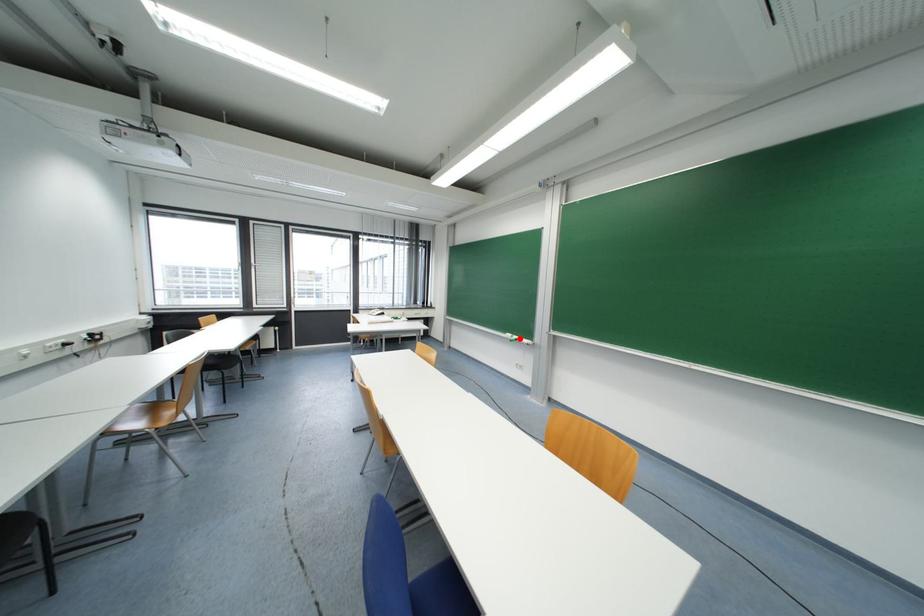
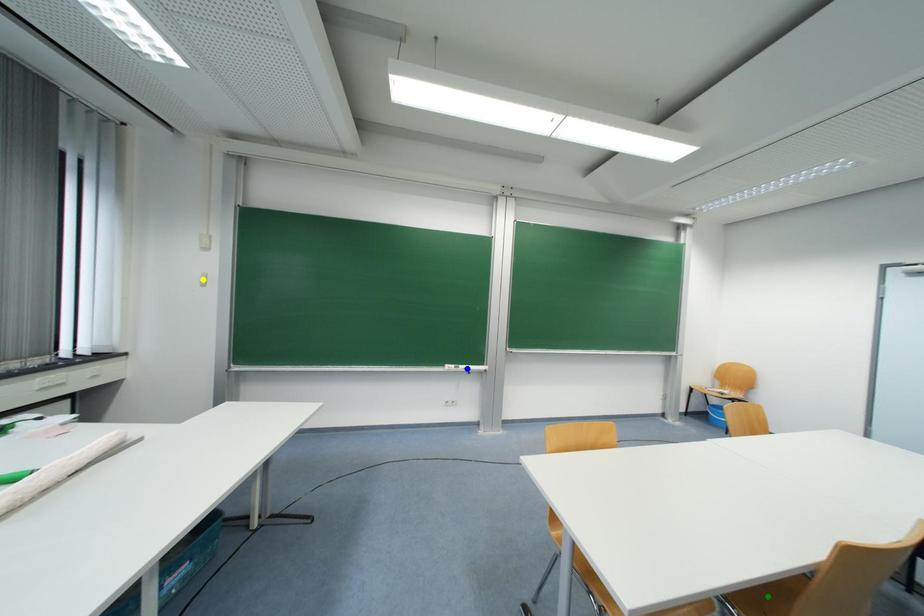
Question: I am providing you with two images of the same scene from different viewpoints. A red point is marked on the first image. You are given multiple points on the second image. Which spot in image 2 lines up with the point in image 1?

Choices:
 (A) green point
 (B) yellow point
 (C) blue point

Answer: (C)